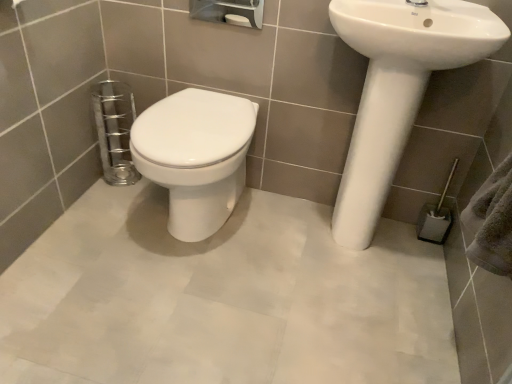
Question: Considering the relative sizes of white glossy sink at right and gray fabric towel bar at lower right in the image provided, is white glossy sink at right taller than gray fabric towel bar at lower right?

Choices:
 (A) no
 (B) yes

Answer: (B)

Question: Is the depth of white glossy sink at right less than that of gray fabric towel bar at lower right?

Choices:
 (A) no
 (B) yes

Answer: (B)

Question: Considering the relative sizes of white glossy sink at right and gray fabric towel bar at lower right in the image provided, is white glossy sink at right thinner than gray fabric towel bar at lower right?

Choices:
 (A) no
 (B) yes

Answer: (A)

Question: Considering the relative sizes of white glossy sink at right and gray fabric towel bar at lower right in the image provided, is white glossy sink at right smaller than gray fabric towel bar at lower right?

Choices:
 (A) no
 (B) yes

Answer: (A)

Question: Would you say gray fabric towel bar at lower right is part of white glossy sink at right's contents?

Choices:
 (A) yes
 (B) no

Answer: (B)

Question: From their relative heights in the image, would you say white glossy sink at right is taller or shorter than white glossy bidet at center?

Choices:
 (A) short
 (B) tall

Answer: (B)

Question: Based on their sizes in the image, would you say white glossy sink at right is bigger or smaller than white glossy bidet at center?

Choices:
 (A) big
 (B) small

Answer: (A)

Question: Is white glossy sink at right to the left or to the right of white glossy bidet at center in the image?

Choices:
 (A) left
 (B) right

Answer: (B)

Question: From the image's perspective, is white glossy sink at right above or below white glossy bidet at center?

Choices:
 (A) above
 (B) below

Answer: (A)

Question: Is white glossy sink at upper right inside or outside of white glossy bidet at center?

Choices:
 (A) outside
 (B) inside

Answer: (A)

Question: Visually, is white glossy sink at upper right positioned to the left or to the right of white glossy bidet at center?

Choices:
 (A) right
 (B) left

Answer: (A)

Question: Considering the positions of white glossy sink at upper right and white glossy bidet at center in the image, is white glossy sink at upper right wider or thinner than white glossy bidet at center?

Choices:
 (A) wide
 (B) thin

Answer: (B)

Question: From a real-world perspective, is white glossy sink at upper right positioned above or below white glossy bidet at center?

Choices:
 (A) above
 (B) below

Answer: (A)

Question: From the image's perspective, is white glossy bidet at center positioned above or below white glossy sink at upper right?

Choices:
 (A) below
 (B) above

Answer: (A)

Question: In the image, is white glossy bidet at center on the left side or the right side of white glossy sink at upper right?

Choices:
 (A) left
 (B) right

Answer: (A)